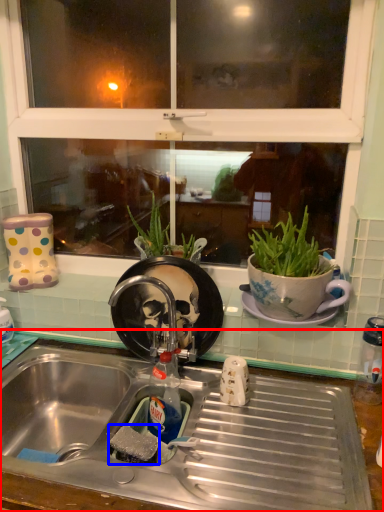
Question: Which object appears farthest to the camera in this image, desk (highlighted by a red box) or food (highlighted by a blue box)?

Choices:
 (A) desk
 (B) food

Answer: (B)